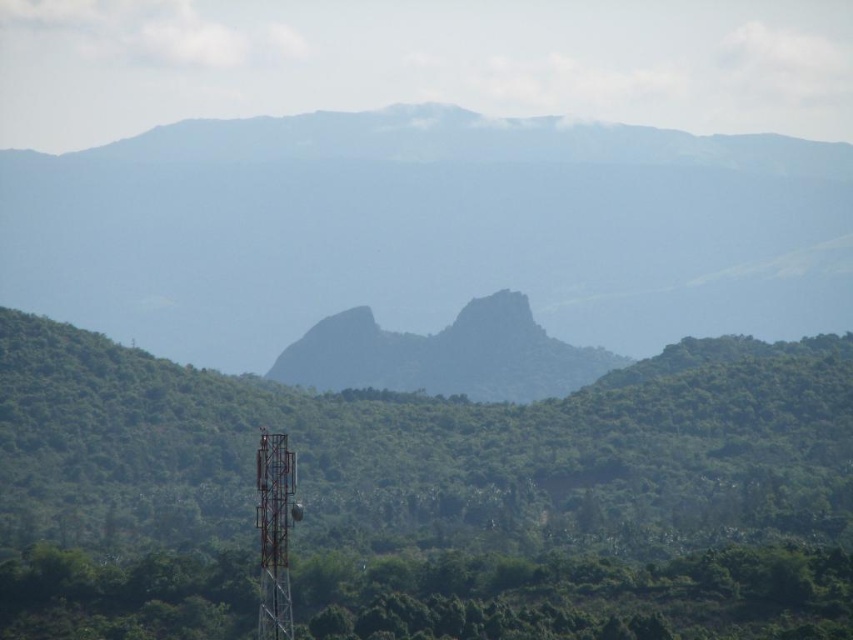
Question: Which of the following is the farthest from the observer?

Choices:
 (A) green textured mountain at center
 (B) green leafy vegetation at center
 (C) metallic tower at center

Answer: (A)

Question: Which of the following is the farthest from the observer?

Choices:
 (A) (502, 397)
 (B) (799, 172)

Answer: (B)

Question: Is green textured mountain at center above metallic tower at center?

Choices:
 (A) yes
 (B) no

Answer: (A)

Question: Which point is closer to the camera taking this photo?

Choices:
 (A) (604, 564)
 (B) (376, 340)

Answer: (A)

Question: Is green rough rock at center bigger than metallic tower at center?

Choices:
 (A) no
 (B) yes

Answer: (A)

Question: From the image, what is the correct spatial relationship of green textured mountain at center in relation to green leafy vegetation at center?

Choices:
 (A) right
 (B) left

Answer: (A)